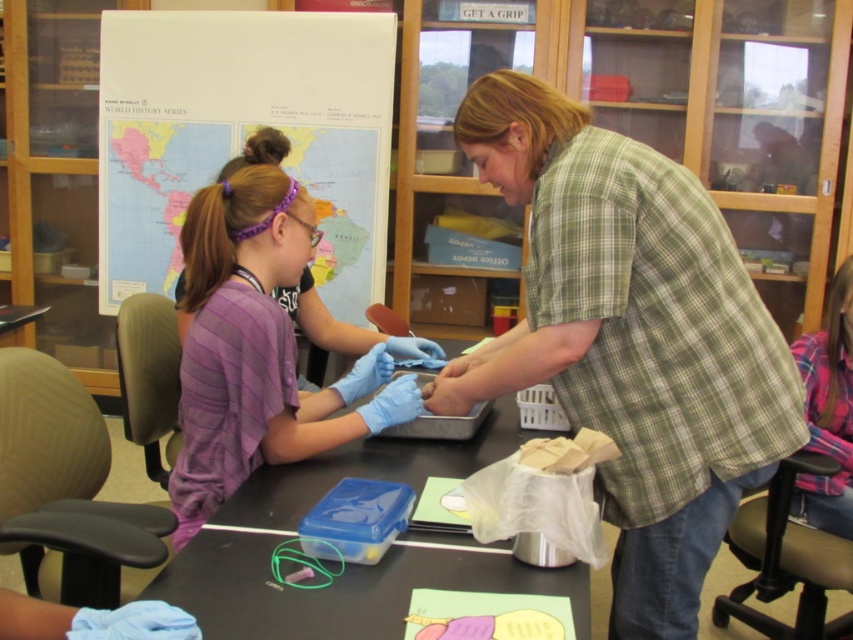
In the scene shown: You are standing in the classroom and want to locate the purple striped shirt at left. According to the coordinates provided, where should you look?

The purple striped shirt at left is located at coordinates point (256, 348).

You are standing in the classroom and want to reach the point marked at coordinates (670,307). If you can extend your arm 1.5 meters, will you be able to touch that point?

The distance between you and the point is 1.46 meters, so yes, you can touch the point since your arm can reach 1.5 meters.

You are a student in the classroom and need to reach the black plastic table at center. The purple striped shirt at left is in your way. Can you move around the shirt to access the table?

The purple striped shirt at left is above the black plastic table at center, which means the shirt is positioned higher than the table. Since the shirt is above the table, you can move around it to access the table as long as there is space beside or behind the shirt.